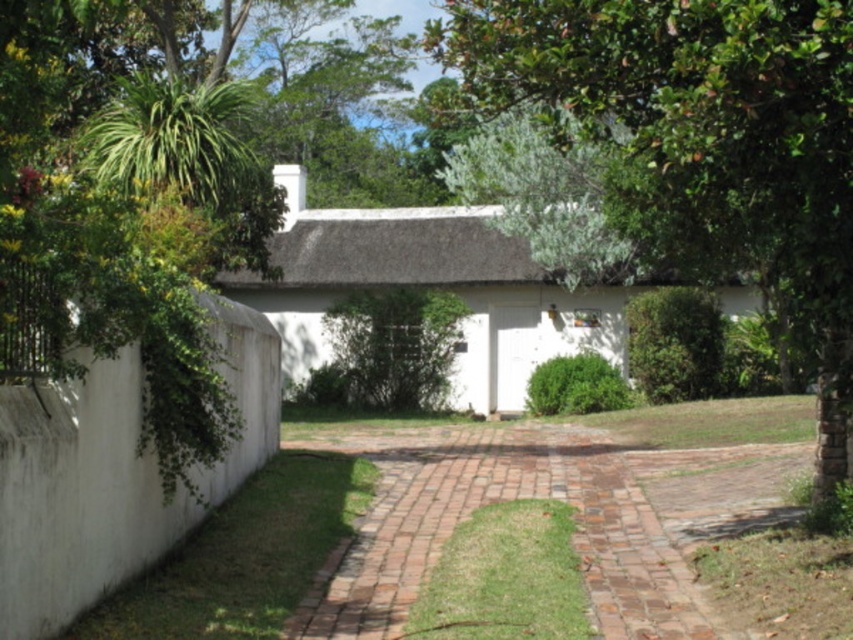
You are a gardener planning to plant a new tree in the residential area. The green leafy tree at center and the brick paved path at center are both in your sight. Which of these two has a smaller width?

The green leafy tree at center has a lesser width compared to the brick paved path at center.

You are planning to plant a new tree in your backyard. You have a space that can accommodate a tree up to the size of the white matte cottage at center. Based on the image, will the green leafy tree at center fit in that space?

The green leafy tree at center is bigger than the white matte cottage at center, so it will not fit in the space allocated for a tree of the cottage size.

You are standing at the entrance of the white house with a thatched roof and want to walk to the brick paved path at center. According to the coordinates provided, which direction should you head towards?

The brick paved path at center is located at coordinates point (544, 497), so you should head towards the center of the image to reach it.